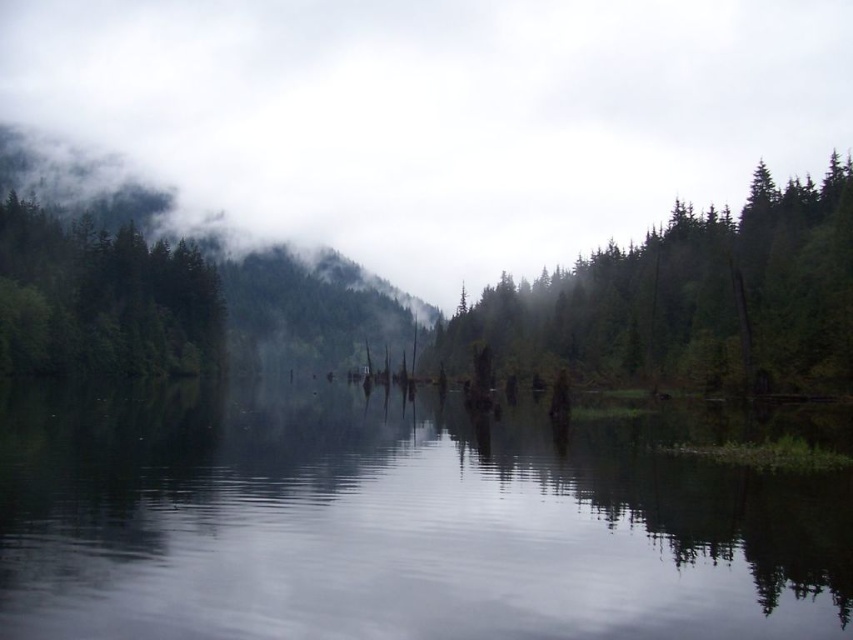
Is white fluffy clouds at upper center above green matte tree at center?

Correct, white fluffy clouds at upper center is located above green matte tree at center.

Which is below, white fluffy clouds at upper center or green matte tree at center?

green matte tree at center is lower down.

Does point (328, 129) come farther from viewer compared to point (778, 381)?

Yes, it is.

Find the location of a particular element. white fluffy clouds at upper center is located at coordinates (436, 115).

Looking at this image, does white fluffy clouds at upper center have a lesser height compared to green matte tree at upper left?

No.

From the picture: Can you confirm if white fluffy clouds at upper center is positioned to the right of green matte tree at upper left?

Indeed, white fluffy clouds at upper center is positioned on the right side of green matte tree at upper left.

Which is in front, point (62, 36) or point (94, 346)?

Point (94, 346)

This screenshot has height=640, width=853. In order to click on white fluffy clouds at upper center in this screenshot , I will do `click(436, 115)`.

Between green matte tree at center and green matte tree at upper left, which one appears on the left side from the viewer's perspective?

From the viewer's perspective, green matte tree at upper left appears more on the left side.

Is point (740, 326) behind point (160, 321)?

No, it is not.

Where is `green matte tree at center`? This screenshot has height=640, width=853. green matte tree at center is located at coordinates (688, 301).